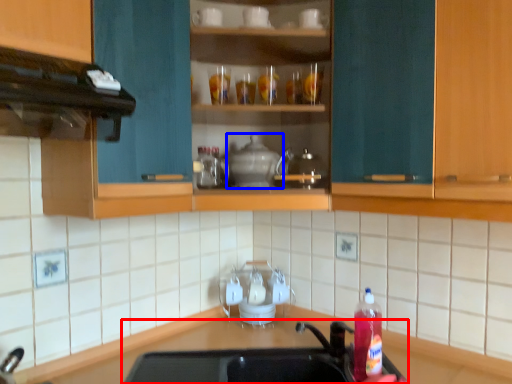
Question: Which of the following is the farthest to the observer, sink (highlighted by a red box) or appliance (highlighted by a blue box)?

Choices:
 (A) sink
 (B) appliance

Answer: (B)